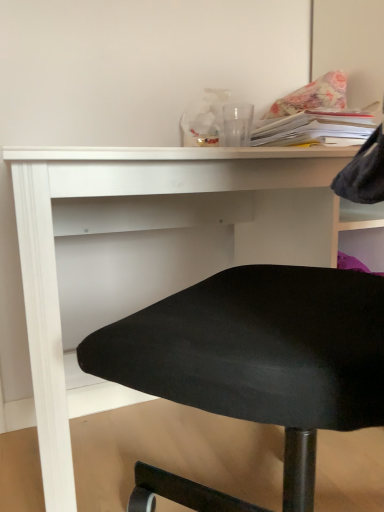
Question: Looking at their shapes, would you say white matte desk at center is wider or thinner than floral fabric pillow at upper right?

Choices:
 (A) wide
 (B) thin

Answer: (A)

Question: Considering the positions of point (94, 390) and point (312, 99), is point (94, 390) closer or farther from the camera than point (312, 99)?

Choices:
 (A) farther
 (B) closer

Answer: (A)

Question: Based on their relative distances, which object is farther from the floral fabric pillow at upper right?

Choices:
 (A) white paper stack at upper right
 (B) white matte desk at center

Answer: (B)

Question: Estimate the real-world distances between objects in this image. Which object is farther from the white matte desk at center?

Choices:
 (A) floral fabric pillow at upper right
 (B) white paper stack at upper right

Answer: (A)